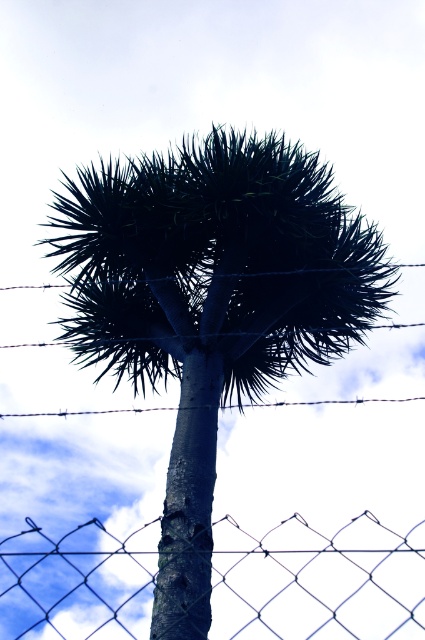
You are a gardener planning to install a new fence. You have a limited amount of fencing material. Given the image, which object between the wire mesh fence at center and the barbed wire at center requires more material to construct based on their widths?

The wire mesh fence at center requires more material to construct because its width is greater than the barbed wire at center.

You are a painter standing at a distance from the dark green textured palm tree at center and the wire mesh fence at center. Which object would appear bigger in your painting if you paint them to scale?

The dark green textured palm tree at center would appear bigger in the painting because it has a larger size compared to the wire mesh fence at center.